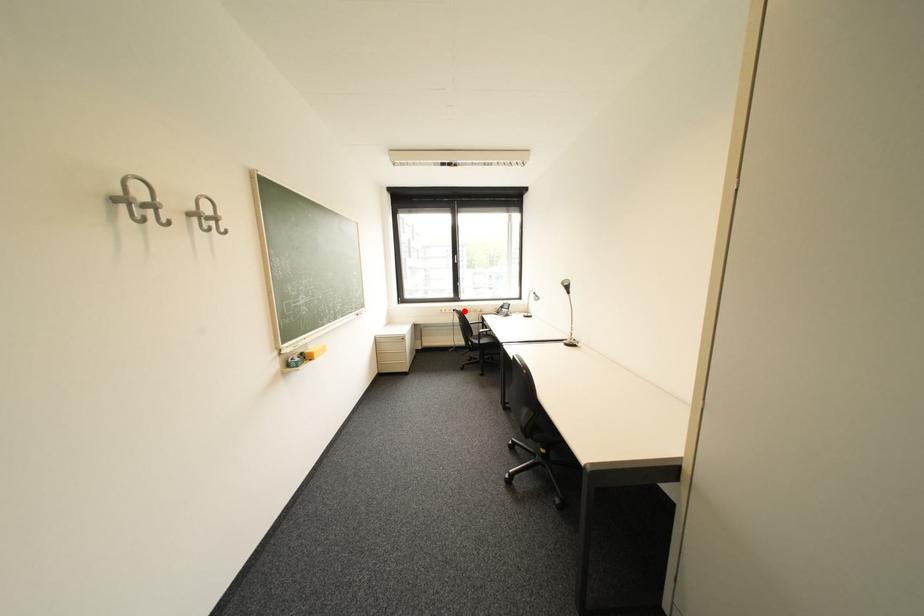
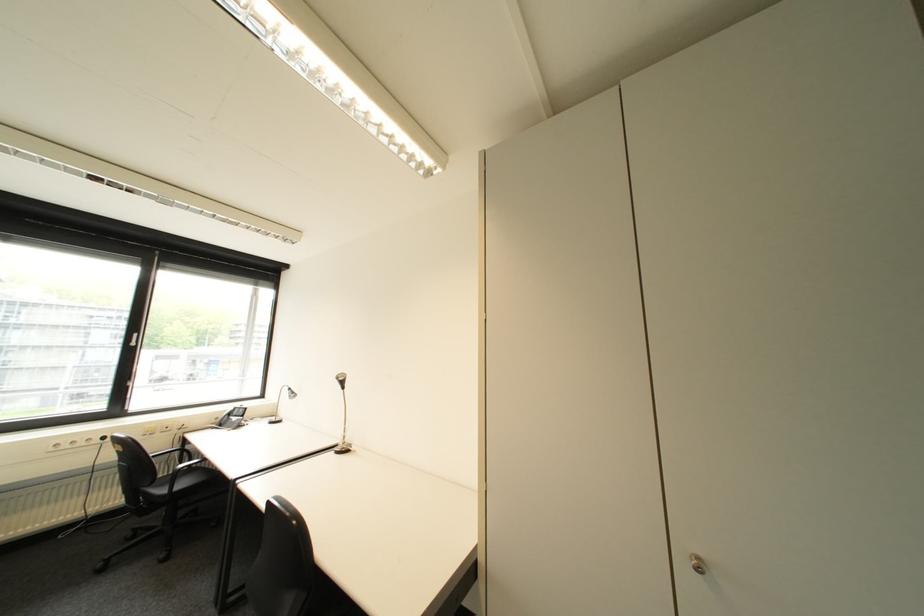
Locate, in the second image, the point that corresponds to the highlighted location in the first image.

(114, 439)